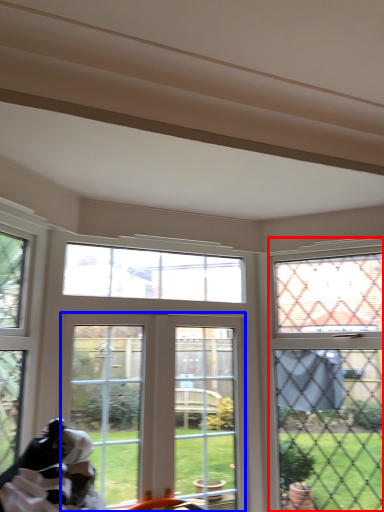
Question: Which point is closer to the camera, window (highlighted by a red box) or window (highlighted by a blue box)?

Choices:
 (A) window
 (B) window

Answer: (A)